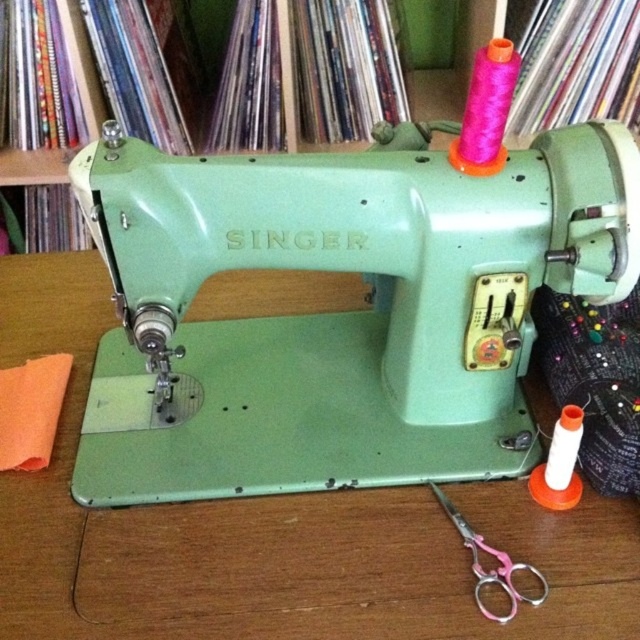
Describe the element at coordinates (272, 532) in the screenshot. I see `green matte sewing machine at center` at that location.

Is green matte sewing machine at center to the right of pink plastic scissors at lower right from the viewer's perspective?

In fact, green matte sewing machine at center is to the left of pink plastic scissors at lower right.

Does point (250, 580) come farther from viewer compared to point (461, 525)?

No, it is not.

What are the coordinates of `green matte sewing machine at center` in the screenshot? It's located at (272, 532).

Looking at this image, is matte green sewing machine at center taller than green matte sewing machine at center?

Correct, matte green sewing machine at center is much taller as green matte sewing machine at center.

Which is behind, point (428, 184) or point (323, 589)?

Positioned behind is point (323, 589).

Image resolution: width=640 pixels, height=640 pixels. Find the location of `matte green sewing machine at center`. matte green sewing machine at center is located at coordinates (342, 312).

Consider the image. Is matte green sewing machine at center bigger than pink plastic scissors at lower right?

Indeed, matte green sewing machine at center has a larger size compared to pink plastic scissors at lower right.

What do you see at coordinates (342, 312) in the screenshot?
I see `matte green sewing machine at center` at bounding box center [342, 312].

The width and height of the screenshot is (640, 640). What are the coordinates of `matte green sewing machine at center` in the screenshot? It's located at (342, 312).